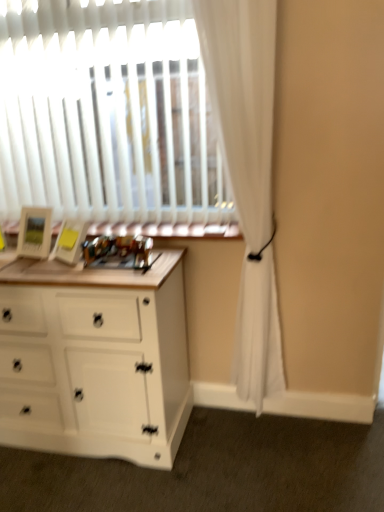
In order to click on blank space situated above white matte chest of drawers at left (from a real-world perspective) in this screenshot , I will do `click(64, 264)`.